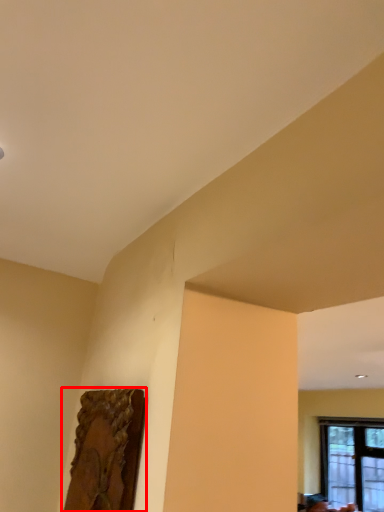
Question: Considering the relative positions of picture frame (annotated by the red box) and window in the image provided, where is picture frame (annotated by the red box) located with respect to the staircase?

Choices:
 (A) left
 (B) right

Answer: (A)